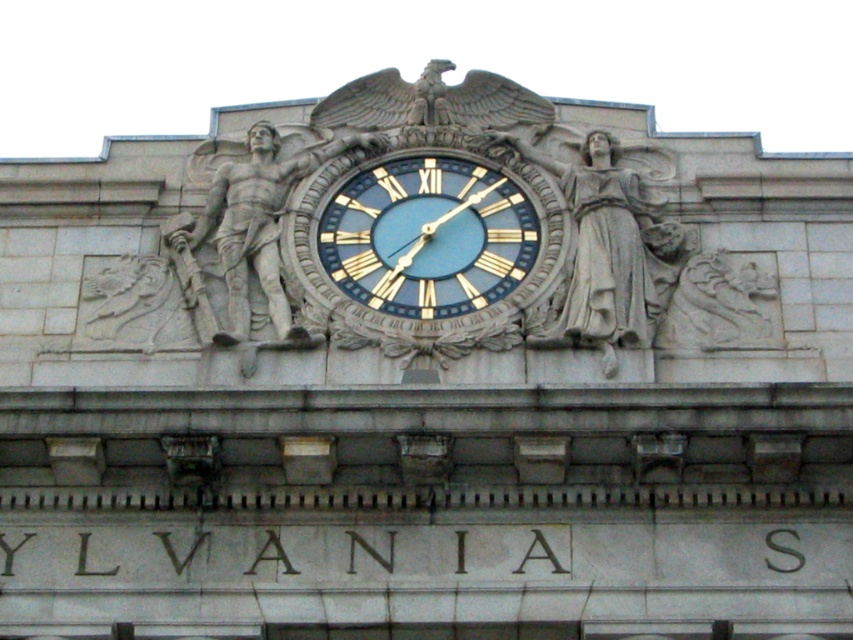
You are an architect reviewing the building design. The blue metallic clock at center and the stone warrior at center are both part of the decorative elements. Based on their sizes, which one would you say is taller?

The blue metallic clock at center has a lesser height compared to stone warrior at center, so the stone warrior at center is taller.

You are standing in front of the building depicted in the image. The blue metallic clock at center is represented by point (428, 236). Can you determine the position of the clock relative to the eagle relief sculpture above it?

The blue metallic clock at center is represented by point (428, 236), so the clock is located below the eagle relief sculpture since the eagle is above the clock in the image.